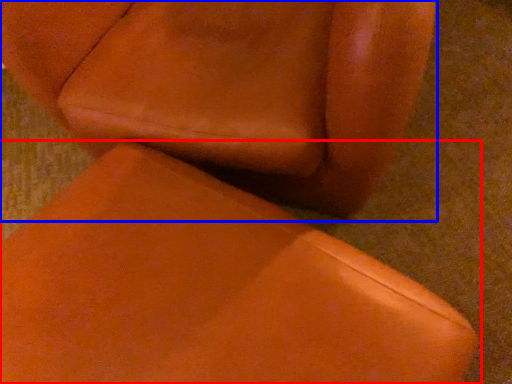
Question: Which object appears farthest to the camera in this image, chair (highlighted by a red box) or chair (highlighted by a blue box)?

Choices:
 (A) chair
 (B) chair

Answer: (B)